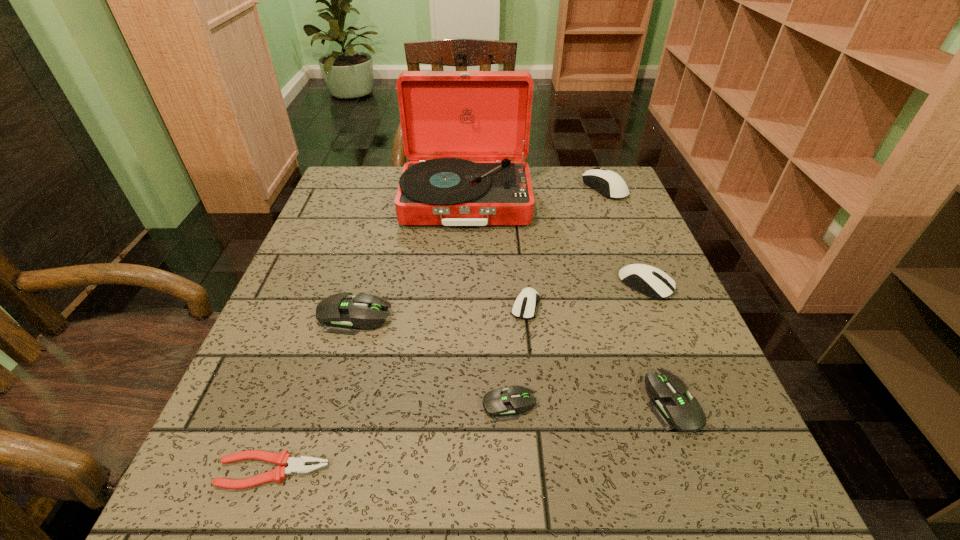
Where is `phonograph_record positioned at the far edge`? This screenshot has height=540, width=960. phonograph_record positioned at the far edge is located at coordinates (447, 118).

The image size is (960, 540). Find the location of `mouse that is at the far edge`. mouse that is at the far edge is located at coordinates (597, 178).

At what (x,y) coordinates should I click in order to perform the action: click on object at the near edge. Please return your answer as a coordinate pair (x, y). The width and height of the screenshot is (960, 540). Looking at the image, I should click on tap(297, 465).

What are the coordinates of `computer mouse that is positioned at the left edge` in the screenshot? It's located at (339, 313).

Find the location of a particular element. This screenshot has width=960, height=540. pliers at the left edge is located at coordinates (297, 465).

In order to click on object located at the near left corner in this screenshot , I will do `click(297, 465)`.

Where is `object positioned at the far right corner`? This screenshot has width=960, height=540. object positioned at the far right corner is located at coordinates (597, 178).

In the image, there is a desktop. Find the location of `vacant region at the far edge`. vacant region at the far edge is located at coordinates (572, 205).

In the image, there is a desktop. In order to click on free region at the near edge in this screenshot , I will do `click(368, 507)`.

This screenshot has width=960, height=540. I want to click on vacant space at the left edge of the desktop, so click(300, 262).